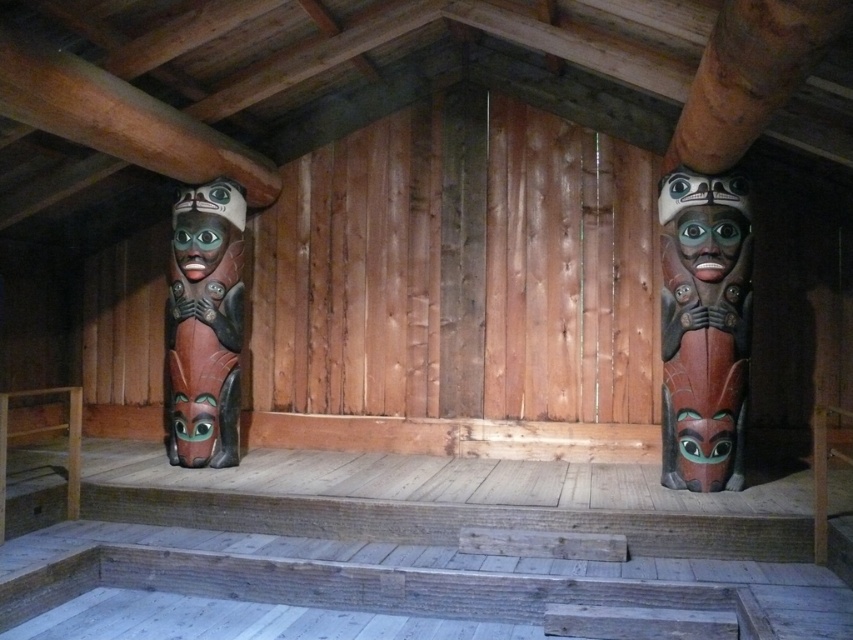
You are standing at the entrance of the traditional wooden structure. You want to take a photo of the polished wood totem pole at right. Where should you position yourself to ensure it is centered in your camera frame?

To center the polished wood totem pole at right in your camera frame, position yourself directly in front of the point at coordinates (x=704, y=326) where the totem pole is located.